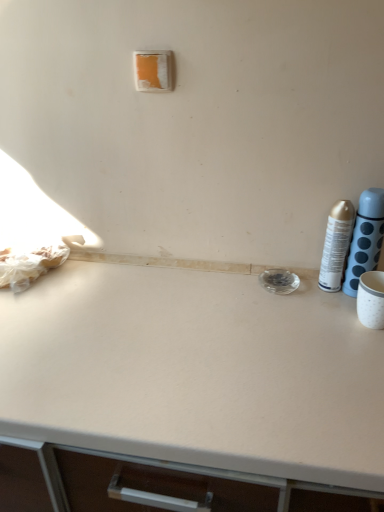
At what (x,y) coordinates should I click in order to perform the action: click on silver metallic can at right, which appears as the first bottle when viewed from the left. Please return your answer as a coordinate pair (x, y). Looking at the image, I should click on (336, 245).

Find the location of a particular element. orange matte/light switch at upper center is located at coordinates (153, 71).

What are the coordinates of `metallic silver spray can at right, positioned as the first bottle in right-to-left order` in the screenshot? It's located at (365, 239).

Which object is closer to the camera taking this photo, orange matte/light switch at upper center or silver metallic can at right, which appears as the first bottle when viewed from the left?

silver metallic can at right, which appears as the first bottle when viewed from the left.

Could you measure the distance between orange matte/light switch at upper center and silver metallic can at right, which appears as the first bottle when viewed from the left?

orange matte/light switch at upper center is 19.93 inches away from silver metallic can at right, which appears as the first bottle when viewed from the left.

Is orange matte/light switch at upper center to the left of silver metallic can at right, which appears as the first bottle when viewed from the left, from the viewer's perspective?

Indeed, orange matte/light switch at upper center is positioned on the left side of silver metallic can at right, which appears as the first bottle when viewed from the left.

Identify the location of light switch located above the silver metallic can at right, placed as the 2th bottle when sorted from right to left (from a real-world perspective). (153, 71).

Consider the image. Could orange matte/light switch at upper center be considered to be inside silver metallic can at right, placed as the 2th bottle when sorted from right to left?

No, orange matte/light switch at upper center is not inside silver metallic can at right, placed as the 2th bottle when sorted from right to left.

From a real-world perspective, which is physically above, silver metallic can at right, placed as the 2th bottle when sorted from right to left, or orange matte/light switch at upper center?

orange matte/light switch at upper center is physically above.

The width and height of the screenshot is (384, 512). I want to click on bottle that is the 2nd one below the orange matte/light switch at upper center (from a real-world perspective), so click(x=336, y=245).

Is silver metallic can at right, which appears as the first bottle when viewed from the left, aimed at orange matte/light switch at upper center?

No, silver metallic can at right, which appears as the first bottle when viewed from the left, is not facing towards orange matte/light switch at upper center.

Could you tell me if metallic silver spray can at right, positioned as the first bottle in right-to-left order, is turned towards silver metallic can at right, placed as the 2th bottle when sorted from right to left?

No, metallic silver spray can at right, positioned as the first bottle in right-to-left order, is not facing towards silver metallic can at right, placed as the 2th bottle when sorted from right to left.

From a real-world perspective, between metallic silver spray can at right, acting as the 2th bottle starting from the left, and silver metallic can at right, which appears as the first bottle when viewed from the left, who is vertically higher?

metallic silver spray can at right, acting as the 2th bottle starting from the left, from a real-world perspective.

From the image's perspective, which object appears higher, metallic silver spray can at right, acting as the 2th bottle starting from the left, or silver metallic can at right, which appears as the first bottle when viewed from the left?

metallic silver spray can at right, acting as the 2th bottle starting from the left, is shown above in the image.

Is metallic silver spray can at right, acting as the 2th bottle starting from the left, at the left side of silver metallic can at right, placed as the 2th bottle when sorted from right to left?

No, metallic silver spray can at right, acting as the 2th bottle starting from the left, is not to the left of silver metallic can at right, placed as the 2th bottle when sorted from right to left.

Considering their positions, is silver metallic can at right, placed as the 2th bottle when sorted from right to left, located in front of or behind metallic silver spray can at right, acting as the 2th bottle starting from the left?

Clearly, silver metallic can at right, placed as the 2th bottle when sorted from right to left, is behind metallic silver spray can at right, acting as the 2th bottle starting from the left.

Can you confirm if silver metallic can at right, placed as the 2th bottle when sorted from right to left, is positioned to the left of metallic silver spray can at right, acting as the 2th bottle starting from the left?

Yes, silver metallic can at right, placed as the 2th bottle when sorted from right to left, is to the left of metallic silver spray can at right, acting as the 2th bottle starting from the left.

Is metallic silver spray can at right, positioned as the first bottle in right-to-left order, surrounded by silver metallic can at right, which appears as the first bottle when viewed from the left?

Definitely not — metallic silver spray can at right, positioned as the first bottle in right-to-left order, is not inside silver metallic can at right, which appears as the first bottle when viewed from the left.

Considering the positions of point (161, 54) and point (370, 256), is point (161, 54) closer or farther from the camera than point (370, 256)?

Point (161, 54).

Are orange matte/light switch at upper center and metallic silver spray can at right, acting as the 2th bottle starting from the left, beside each other?

No, orange matte/light switch at upper center is not making contact with metallic silver spray can at right, acting as the 2th bottle starting from the left.

From the image's perspective, between orange matte/light switch at upper center and metallic silver spray can at right, acting as the 2th bottle starting from the left, which one is located above?

orange matte/light switch at upper center appears higher in the image.

How different are the orientations of orange matte/light switch at upper center and metallic silver spray can at right, acting as the 2th bottle starting from the left, in degrees?

The angle between the facing direction of orange matte/light switch at upper center and the facing direction of metallic silver spray can at right, acting as the 2th bottle starting from the left, is 0.195 degrees.

Is metallic silver spray can at right, positioned as the first bottle in right-to-left order, inside or outside of orange matte/light switch at upper center?

metallic silver spray can at right, positioned as the first bottle in right-to-left order, is spatially situated outside orange matte/light switch at upper center.

Is metallic silver spray can at right, positioned as the first bottle in right-to-left order, wider or thinner than orange matte/light switch at upper center?

In the image, metallic silver spray can at right, positioned as the first bottle in right-to-left order, appears to be wider than orange matte/light switch at upper center.

What's the angular difference between metallic silver spray can at right, acting as the 2th bottle starting from the left, and orange matte/light switch at upper center's facing directions?

There is a 0.195-degree angle between the facing directions of metallic silver spray can at right, acting as the 2th bottle starting from the left, and orange matte/light switch at upper center.

Based on their sizes in the image, would you say metallic silver spray can at right, acting as the 2th bottle starting from the left, is bigger or smaller than orange matte/light switch at upper center?

Clearly, metallic silver spray can at right, acting as the 2th bottle starting from the left, is larger in size than orange matte/light switch at upper center.

Where is `light switch that is on the left side of silver metallic can at right, which appears as the first bottle when viewed from the left`? This screenshot has width=384, height=512. light switch that is on the left side of silver metallic can at right, which appears as the first bottle when viewed from the left is located at coordinates (153, 71).

Where is `light switch that appears above the silver metallic can at right, which appears as the first bottle when viewed from the left (from the image's perspective)`? This screenshot has width=384, height=512. light switch that appears above the silver metallic can at right, which appears as the first bottle when viewed from the left (from the image's perspective) is located at coordinates (153, 71).

When comparing their distances from silver metallic can at right, placed as the 2th bottle when sorted from right to left, does metallic silver spray can at right, acting as the 2th bottle starting from the left, or orange matte/light switch at upper center seem closer?

Based on the image, metallic silver spray can at right, acting as the 2th bottle starting from the left, appears to be nearer to silver metallic can at right, placed as the 2th bottle when sorted from right to left.

Looking at the image, which one is located closer to orange matte/light switch at upper center, metallic silver spray can at right, positioned as the first bottle in right-to-left order, or silver metallic can at right, which appears as the first bottle when viewed from the left?

silver metallic can at right, which appears as the first bottle when viewed from the left, lies closer to orange matte/light switch at upper center than the other object.

Which object lies further to the anchor point metallic silver spray can at right, positioned as the first bottle in right-to-left order, orange matte/light switch at upper center or silver metallic can at right, which appears as the first bottle when viewed from the left?

Among the two, orange matte/light switch at upper center is located further to metallic silver spray can at right, positioned as the first bottle in right-to-left order.

Based on their spatial positions, is orange matte/light switch at upper center or metallic silver spray can at right, acting as the 2th bottle starting from the left, closer to silver metallic can at right, which appears as the first bottle when viewed from the left?

The object closer to silver metallic can at right, which appears as the first bottle when viewed from the left, is metallic silver spray can at right, acting as the 2th bottle starting from the left.

When comparing their distances from metallic silver spray can at right, acting as the 2th bottle starting from the left, does silver metallic can at right, placed as the 2th bottle when sorted from right to left, or orange matte/light switch at upper center seem further?

Based on the image, orange matte/light switch at upper center appears to be further to metallic silver spray can at right, acting as the 2th bottle starting from the left.

Considering their positions, is silver metallic can at right, placed as the 2th bottle when sorted from right to left, positioned closer to orange matte/light switch at upper center than metallic silver spray can at right, acting as the 2th bottle starting from the left?

silver metallic can at right, placed as the 2th bottle when sorted from right to left, is positioned closer to the anchor orange matte/light switch at upper center.

At what (x,y) coordinates should I click in order to perform the action: click on bottle between orange matte/light switch at upper center and metallic silver spray can at right, acting as the 2th bottle starting from the left, from left to right. Please return your answer as a coordinate pair (x, y). The height and width of the screenshot is (512, 384). Looking at the image, I should click on (336, 245).